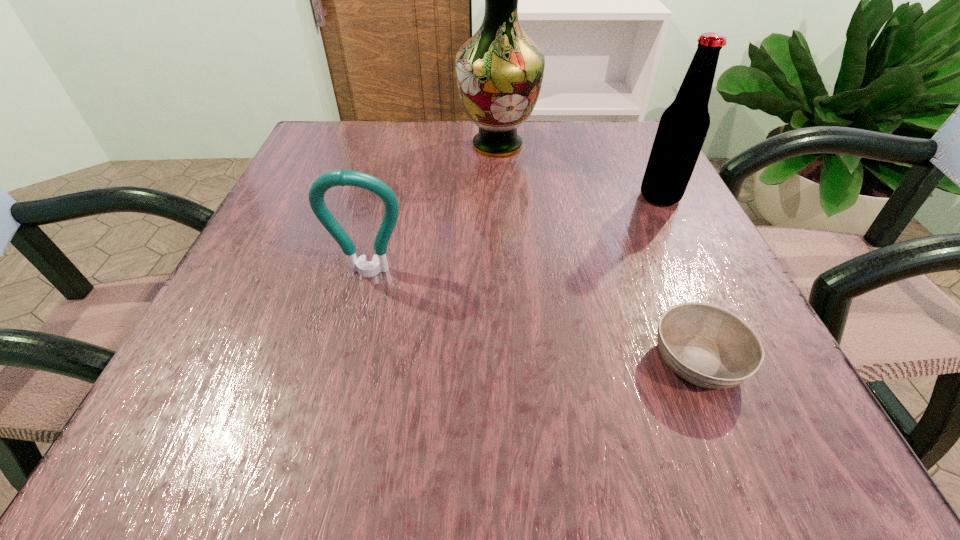
Image resolution: width=960 pixels, height=540 pixels. In order to click on vacant area located at the jaws of the second nearest object in this screenshot , I will do `click(338, 396)`.

I want to click on free space located 0.290m on the left of the bowl, so click(x=427, y=361).

At what (x,y) coordinates should I click in order to perform the action: click on object at the far edge. Please return your answer as a coordinate pair (x, y). The image size is (960, 540). Looking at the image, I should click on (x=499, y=71).

Find the location of a particular element. The image size is (960, 540). object that is at the near edge is located at coordinates (708, 346).

Identify the location of object situated at the left edge. (341, 177).

Identify the location of beer bottle that is at the right edge. The image size is (960, 540). (683, 126).

I want to click on bowl that is at the right edge, so pos(708,346).

Find the location of a particular element. The width and height of the screenshot is (960, 540). object situated at the near right corner is located at coordinates (708, 346).

I want to click on vacant area at the far edge, so click(x=579, y=170).

In the image, there is a desktop. Where is `vacant region at the near edge`? The width and height of the screenshot is (960, 540). vacant region at the near edge is located at coordinates (444, 423).